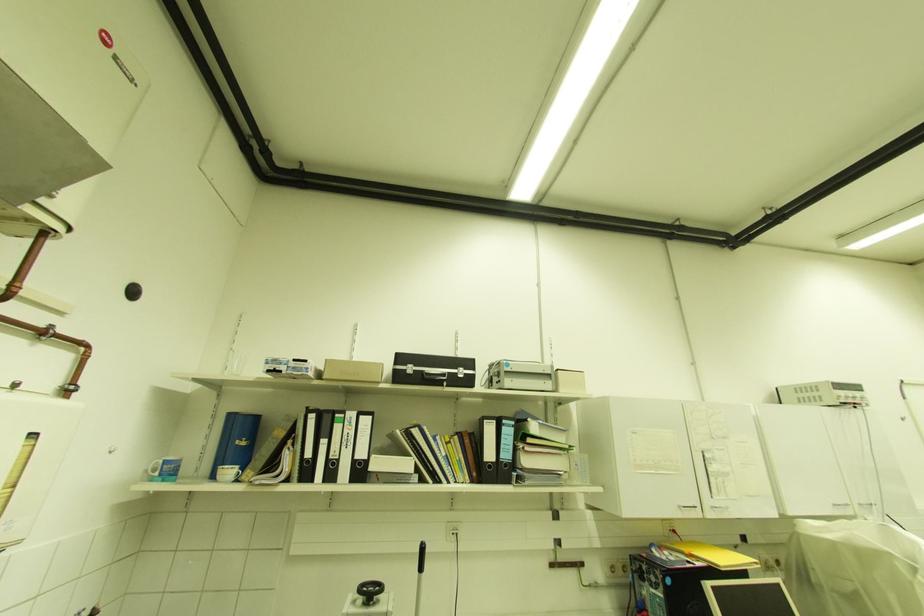
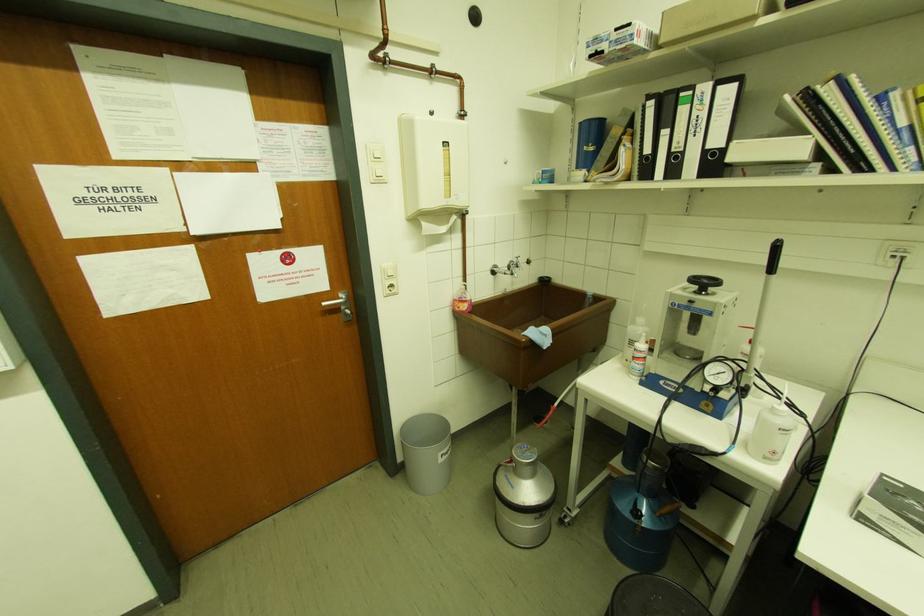
Find the pixel in the second image that matches point (365, 456) in the first image.

(720, 143)